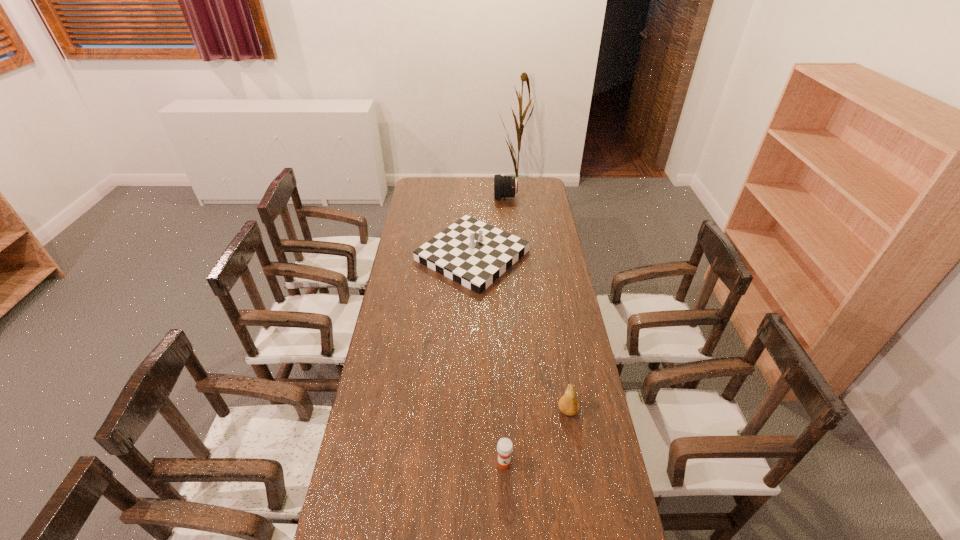
This screenshot has height=540, width=960. What are the coordinates of `free space located 0.100m on the label side of the nearest object` in the screenshot? It's located at (506, 507).

What are the coordinates of `object that is at the far edge` in the screenshot? It's located at (504, 186).

This screenshot has width=960, height=540. I want to click on object present at the left edge, so click(x=470, y=252).

At what (x,y) coordinates should I click in order to perform the action: click on checkerboard that is positioned at the right edge. Please return your answer as a coordinate pair (x, y). Looking at the image, I should click on (470, 252).

Locate an element on the screen. The image size is (960, 540). pear located at the right edge is located at coordinates (568, 404).

In the image, there is a desktop. Identify the location of vacant space at the far edge. (464, 195).

In the image, there is a desktop. Find the location of `vacant space at the left edge`. vacant space at the left edge is located at coordinates tap(374, 413).

I want to click on vacant space at the right edge of the desktop, so click(541, 272).

At what (x,y) coordinates should I click in order to perform the action: click on free spot at the far right corner of the desktop. Please return your answer as a coordinate pair (x, y). This screenshot has height=540, width=960. Looking at the image, I should click on (518, 177).

The width and height of the screenshot is (960, 540). In order to click on vacant space in between the telephoto lens and the nearest object in this screenshot , I will do `click(505, 330)`.